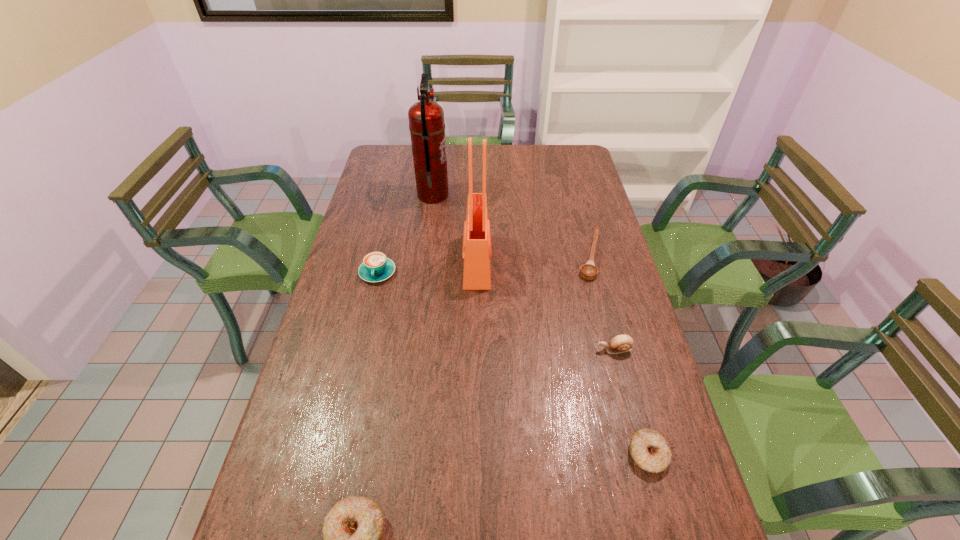
Locate an element on the screen. This screenshot has height=540, width=960. the right doughnut is located at coordinates (649, 449).

Locate an element on the screen. The width and height of the screenshot is (960, 540). the farther doughnut is located at coordinates (649, 449).

I want to click on tote bag, so click(x=476, y=253).

Where is `the farthest object`? Image resolution: width=960 pixels, height=540 pixels. the farthest object is located at coordinates (426, 118).

The image size is (960, 540). I want to click on cappuccino, so (376, 267).

In order to click on the shortest object in this screenshot , I will do `click(589, 271)`.

Where is `the fifth farthest object`? The width and height of the screenshot is (960, 540). the fifth farthest object is located at coordinates (622, 343).

This screenshot has height=540, width=960. What are the coordinates of `free space located 0.320m on the left of the farther doughnut` in the screenshot? It's located at (489, 454).

At what (x,y) coordinates should I click in order to perform the action: click on free location located 0.140m on the logo side of the fourth object from right to left. Please return your answer as a coordinate pair (x, y). Looking at the image, I should click on [533, 261].

At what (x,y) coordinates should I click in order to perform the action: click on free space located on the nozzle side of the fire extinguisher. Please return your answer as a coordinate pair (x, y). This screenshot has height=540, width=960. Looking at the image, I should click on (479, 195).